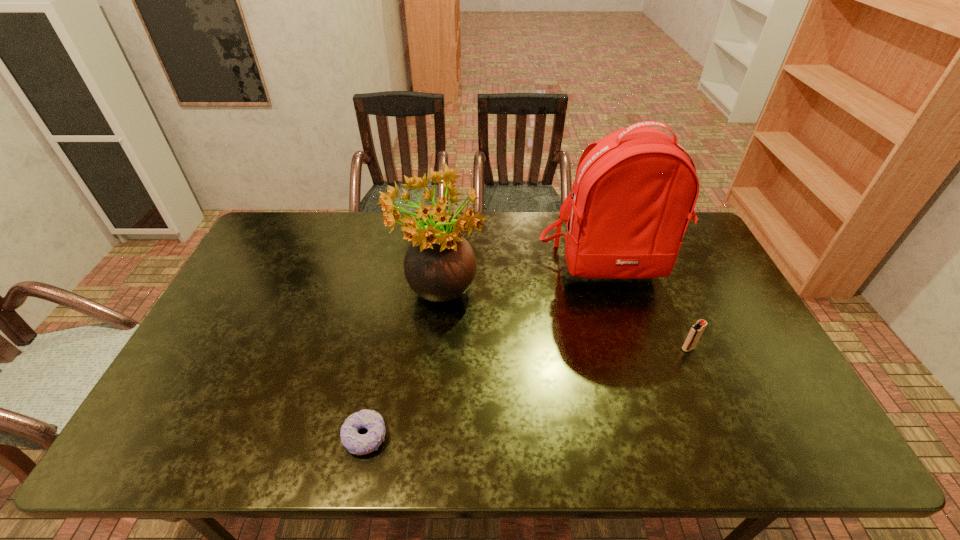
This screenshot has width=960, height=540. In order to click on the tallest object in this screenshot , I will do `click(635, 190)`.

The image size is (960, 540). Find the location of `flower arrangement`. flower arrangement is located at coordinates (440, 265).

The height and width of the screenshot is (540, 960). Find the location of `igniter`. igniter is located at coordinates (696, 330).

Locate an element on the screen. Image resolution: width=960 pixels, height=540 pixels. the second nearest object is located at coordinates (696, 330).

The height and width of the screenshot is (540, 960). What are the coordinates of `the shortest object` in the screenshot? It's located at (355, 443).

Locate an element on the screen. This screenshot has width=960, height=540. the nearest object is located at coordinates (355, 443).

Locate an element on the screen. Image resolution: width=960 pixels, height=540 pixels. free space located on the main compartment of the tallest object is located at coordinates (634, 348).

Identify the location of free region located on the right of the flower arrangement. The height and width of the screenshot is (540, 960). (525, 297).

The image size is (960, 540). In order to click on vacant region located on the left of the second shortest object in this screenshot , I will do `click(660, 348)`.

I want to click on free point located 0.390m on the right of the doughnut, so click(556, 437).